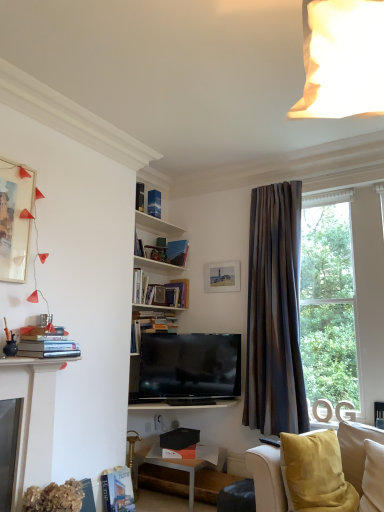
Question: Should I look upward or downward to see hardcover book at center, positioned as the 4th book in top-to-bottom order?

Choices:
 (A) down
 (B) up

Answer: (A)

Question: Is hardcover book at lower left, which is the fifth book from back to front, closer to the viewer compared to satin black tv at center?

Choices:
 (A) no
 (B) yes

Answer: (B)

Question: From the image's perspective, is hardcover book at lower left, the 1th book positioned from the bottom, under satin black tv at center?

Choices:
 (A) yes
 (B) no

Answer: (A)

Question: From a real-world perspective, is hardcover book at lower left, the 2th book when ordered from front to back, over satin black tv at center?

Choices:
 (A) no
 (B) yes

Answer: (A)

Question: Is hardcover book at lower left, the 1th book positioned from the bottom, bigger than satin black tv at center?

Choices:
 (A) no
 (B) yes

Answer: (A)

Question: From the image's perspective, is hardcover book at lower left, which is the fifth book from back to front, above satin black tv at center?

Choices:
 (A) yes
 (B) no

Answer: (B)

Question: Does hardcover book at lower left, the sixth book from the top, have a greater width compared to satin black tv at center?

Choices:
 (A) yes
 (B) no

Answer: (B)

Question: Does blue paper book at upper center, which appears as the 5th book when ordered from the bottom, contain satin black tv at center?

Choices:
 (A) no
 (B) yes

Answer: (A)

Question: From the image's perspective, is blue paper book at upper center, the fourth book viewed from the front, on satin black tv at center?

Choices:
 (A) no
 (B) yes

Answer: (B)

Question: Is blue paper book at upper center, the fourth book viewed from the front, shorter than satin black tv at center?

Choices:
 (A) no
 (B) yes

Answer: (B)

Question: From a real-world perspective, is blue paper book at upper center, acting as the 3th book starting from the back, over satin black tv at center?

Choices:
 (A) no
 (B) yes

Answer: (B)

Question: Does blue paper book at upper center, which appears as the 5th book when ordered from the bottom, appear on the right side of satin black tv at center?

Choices:
 (A) no
 (B) yes

Answer: (A)

Question: Considering the relative sizes of blue paper book at upper center, the fourth book viewed from the front, and satin black tv at center in the image provided, is blue paper book at upper center, the fourth book viewed from the front, thinner than satin black tv at center?

Choices:
 (A) no
 (B) yes

Answer: (B)

Question: Is matte white picture frame at upper left, acting as the 1th picture frame starting from the front, at the right side of hardcover book at center, which is counted as the third book, starting from the top?

Choices:
 (A) no
 (B) yes

Answer: (A)